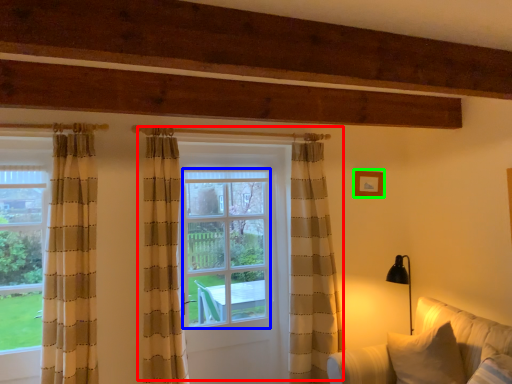
Question: Which object is positioned closest to door (highlighted by a red box)? Select from window screen (highlighted by a blue box) and picture frame (highlighted by a green box).

Choices:
 (A) window screen
 (B) picture frame

Answer: (A)